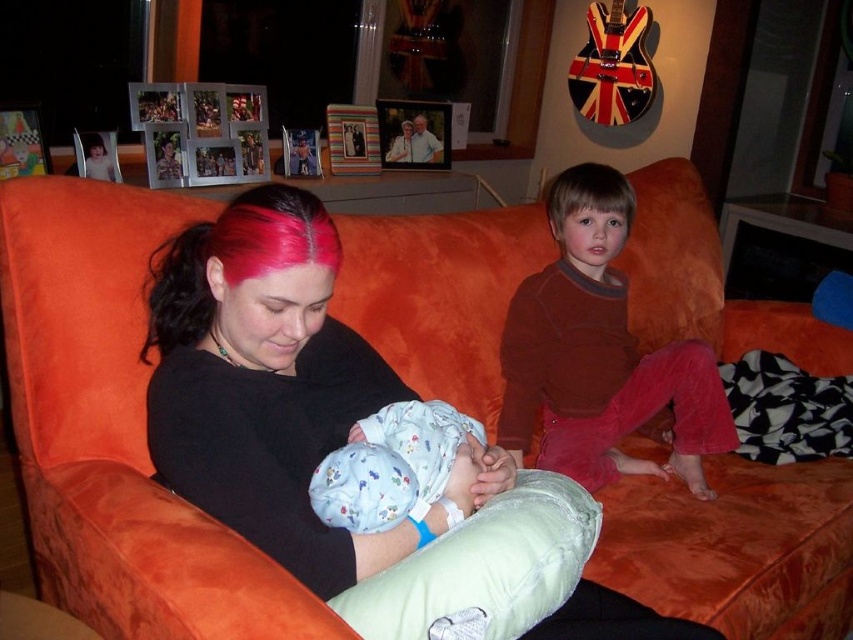
You are a photographer setting up a shoot in this living room. You want to place a small stool between the orange velvet couch at center and the fluffy cotton onesie at center so that it is closer to the couch than the onesie. Is this possible given their positions?

The orange velvet couch at center is further to the viewer than the fluffy cotton onesie at center. Therefore, placing a stool closer to the couch would mean positioning it between the couch and the onesie, which is possible since the couch is already closer to the viewer than the onesie.

You are a delivery person who needs to place a small package between the woman on the left side of the velvet orange couch at right and the young boy on her right. The package requires 2 feet of space to fit comfortably. Can you place it there?

The distance between the woman on the left side of the velvet orange couch at right and the young boy on her right is 5.34 feet, which is more than enough space to place the 2 feet package comfortably.

You are a photographer setting up for a family portrait. You have two points marked in the scene for focus adjustments. The first point is at coordinate point (62, 292) and the second is at coordinate point (730, 449). Which of these points should you focus on first if you want to ensure the closest object is in sharp focus?

Point (62, 292) is closer to the camera than point (730, 449), so you should focus on point (62, 292) first to ensure the closest object is in sharp focus.